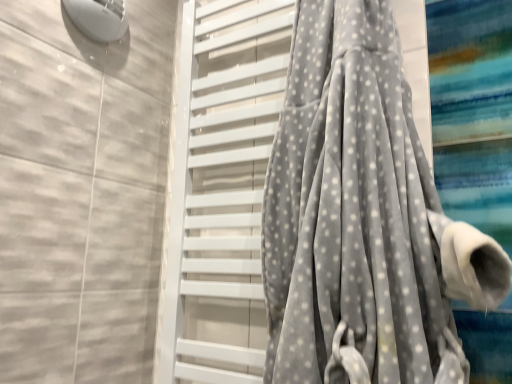
Question: Is gray velvety curtain at center situated inside gray velvety towel at center or outside?

Choices:
 (A) inside
 (B) outside

Answer: (B)

Question: From a real-world perspective, is gray velvety curtain at center positioned above or below gray velvety towel at center?

Choices:
 (A) above
 (B) below

Answer: (B)

Question: Considering their positions, is gray velvety curtain at center located in front of or behind gray velvety towel at center?

Choices:
 (A) front
 (B) behind

Answer: (A)

Question: From the image's perspective, is gray velvety towel at center located above or below gray velvety curtain at center?

Choices:
 (A) below
 (B) above

Answer: (A)

Question: Considering the positions of gray velvety towel at center and gray velvety curtain at center in the image, is gray velvety towel at center wider or thinner than gray velvety curtain at center?

Choices:
 (A) wide
 (B) thin

Answer: (B)

Question: In the image, is gray velvety towel at center positioned in front of or behind gray velvety curtain at center?

Choices:
 (A) behind
 (B) front

Answer: (A)

Question: Based on their sizes in the image, would you say gray velvety towel at center is bigger or smaller than gray velvety curtain at center?

Choices:
 (A) small
 (B) big

Answer: (A)